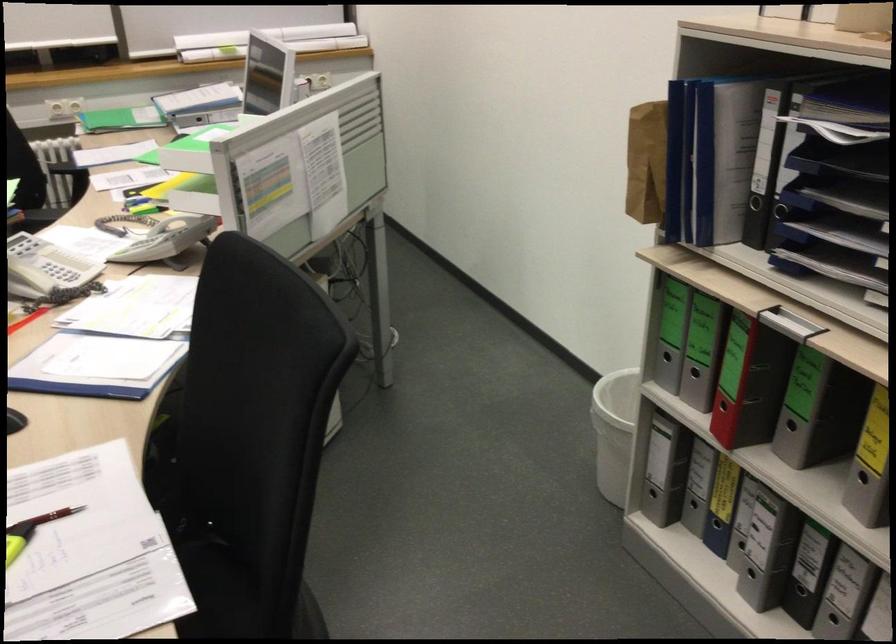
What do you see at coordinates (208, 581) in the screenshot? I see `a chair sitting surface` at bounding box center [208, 581].